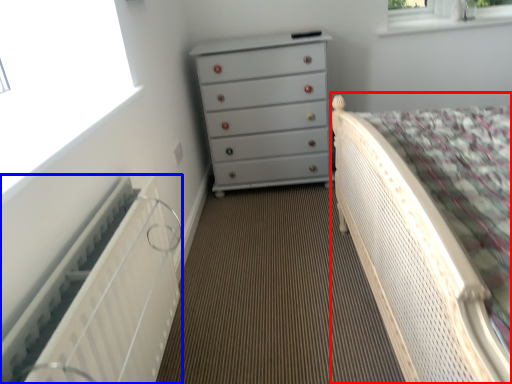
Question: Which object is closer to the camera taking this photo, bed (highlighted by a red box) or radiator (highlighted by a blue box)?

Choices:
 (A) bed
 (B) radiator

Answer: (A)